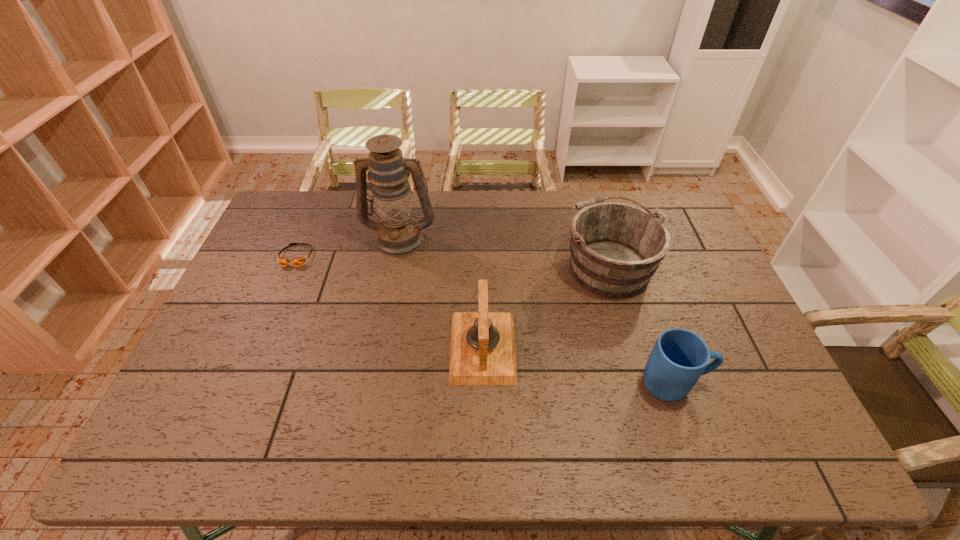
The width and height of the screenshot is (960, 540). Identify the location of the second object from left to right. (398, 234).

Locate an element on the screen. the tallest object is located at coordinates (398, 234).

Locate an element on the screen. Image resolution: width=960 pixels, height=540 pixels. wine bucket is located at coordinates (615, 247).

Where is `the third object from right to left`? the third object from right to left is located at coordinates (482, 352).

Where is `mug`? mug is located at coordinates click(x=680, y=357).

You are a GUI agent. You are given a task and a screenshot of the screen. Output one action in this format:
    pyautogui.click(x=<x>, y=<y>)
    Task: Click on the leftmost object
    The width and height of the screenshot is (960, 540).
    Given the screenshot: What is the action you would take?
    point(284,262)

Identify the location of the shortest object. (284, 262).

Find the location of a particular element. The width and height of the screenshot is (960, 540). vacant space located on the back of the fourth object from right to left is located at coordinates pos(408,197).

The width and height of the screenshot is (960, 540). Find the location of `free space located on the left of the wine bucket`. free space located on the left of the wine bucket is located at coordinates (477, 266).

At what (x,y) coordinates should I click in order to perform the action: click on free point located on the left of the third object from left to right. Please return your answer as a coordinate pair (x, y). The image size is (960, 540). Looking at the image, I should click on (352, 347).